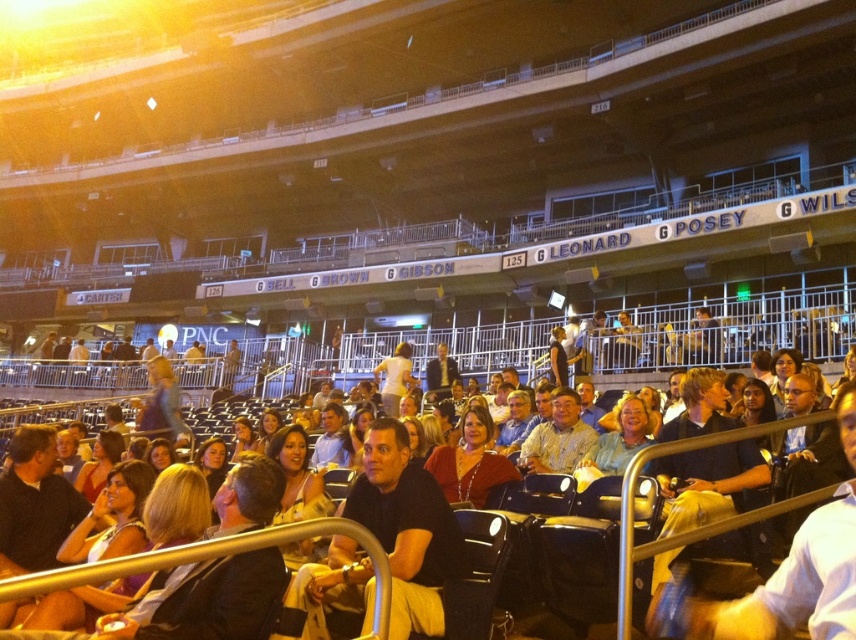
Question: Estimate the real-world distances between objects in this image. Which object is closer to the light brown wood chair at center?

Choices:
 (A) dark blue shirt at center
 (B) matte red sweater at center

Answer: (B)

Question: Is light brown hair at center wider than matte black shirt at center?

Choices:
 (A) yes
 (B) no

Answer: (A)

Question: Does light brown wood chair at center have a smaller size compared to light brown hair at center?

Choices:
 (A) yes
 (B) no

Answer: (B)

Question: Which object is farther from the camera taking this photo?

Choices:
 (A) dark blue shirt at center
 (B) light brown hair at center
 (C) light brown wood chair at center

Answer: (B)

Question: Does light brown hair at center appear on the right side of matte black shirt at center?

Choices:
 (A) yes
 (B) no

Answer: (A)

Question: Which object is farther from the camera taking this photo?

Choices:
 (A) light brown wood chair at center
 (B) matte black shirt at center
 (C) dark blue shirt at center
 (D) light brown hair at center

Answer: (B)